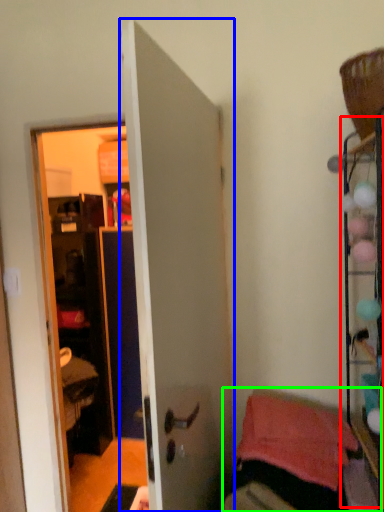
Question: Estimate the real-world distances between objects in this image. Which object is farther from shelf (highlighted by a red box), door (highlighted by a blue box) or furniture (highlighted by a green box)?

Choices:
 (A) door
 (B) furniture

Answer: (A)